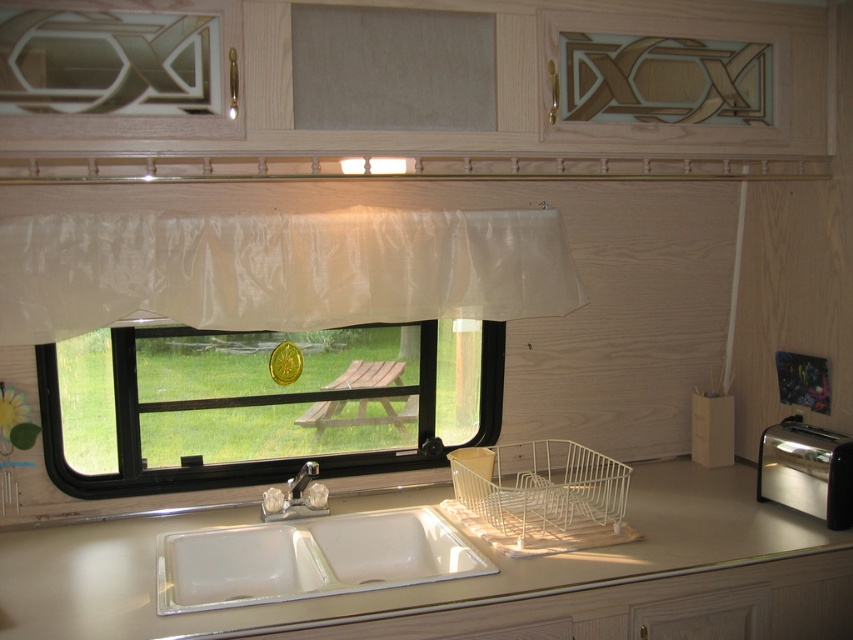
Who is taller, clear crystal faucet at center or silver metallic faucet at sink center?

clear crystal faucet at center

Does clear crystal faucet at center have a larger size compared to silver metallic faucet at sink center?

Yes, clear crystal faucet at center is bigger than silver metallic faucet at sink center.

Measure the distance between point (274, 506) and camera.

The distance of point (274, 506) from camera is 1.83 meters.

Where is `clear crystal faucet at center`? The image size is (853, 640). clear crystal faucet at center is located at coordinates (296, 497).

Who is shorter, black plastic window at center or silver metallic faucet at sink center?

silver metallic faucet at sink center

Does point (160, 372) lie behind point (291, 481)?

That is True.

Identify the location of black plastic window at center. (259, 404).

Is translucent white curtain at upper center positioned at the back of white ceramic sink at center?

Yes, it is behind white ceramic sink at center.

Looking at this image, can you confirm if translucent white curtain at upper center is shorter than white ceramic sink at center?

In fact, translucent white curtain at upper center may be taller than white ceramic sink at center.

Which is in front, point (445, 269) or point (247, 536)?

Point (247, 536) is more forward.

This screenshot has height=640, width=853. I want to click on translucent white curtain at upper center, so click(280, 269).